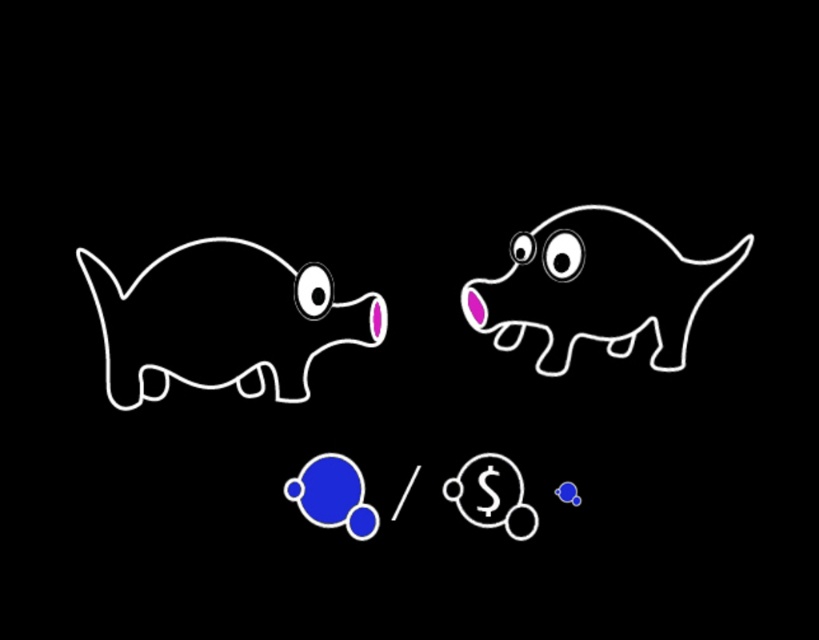
Question: Among these points, which one is farthest from the camera?

Choices:
 (A) (559, 232)
 (B) (532, 244)
 (C) (319, 316)
 (D) (123, 300)

Answer: (C)

Question: Can you confirm if white outline dog at center is thinner than white glossy bubble at upper left?

Choices:
 (A) no
 (B) yes

Answer: (A)

Question: Among these objects, which one is nearest to the camera?

Choices:
 (A) white glossy bubble at upper left
 (B) pink matte piggy bank at left

Answer: (B)

Question: Can you confirm if white outline dog at center is wider than pink matte piggy bank at left?

Choices:
 (A) yes
 (B) no

Answer: (A)

Question: Where is white outline dog at center located in relation to white glossy dog at upper right in the image?

Choices:
 (A) above
 (B) below

Answer: (B)

Question: Which point is farther from the camera taking this photo?

Choices:
 (A) [107, 381]
 (B) [562, 278]

Answer: (B)